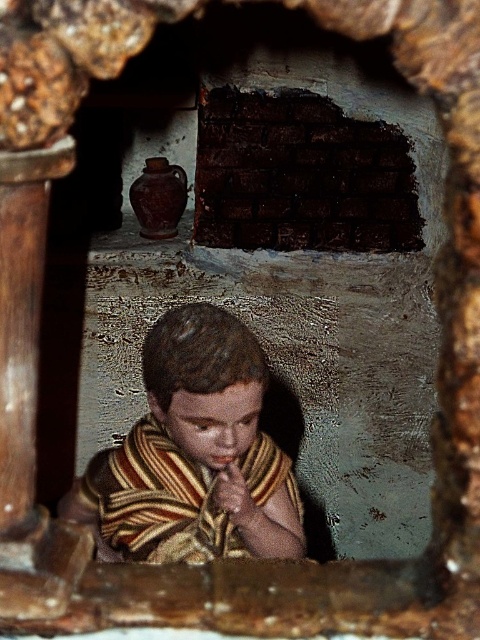
Between striped fabric child at center and dark brick wall at center, which one has less height?

dark brick wall at center

Which is more to the right, striped fabric child at center or dark brick wall at center?

From the viewer's perspective, dark brick wall at center appears more on the right side.

I want to click on striped fabric child at center, so click(x=194, y=454).

At what (x,y) coordinates should I click in order to perform the action: click on striped fabric child at center. Please return your answer as a coordinate pair (x, y). The image size is (480, 640). Looking at the image, I should click on (194, 454).